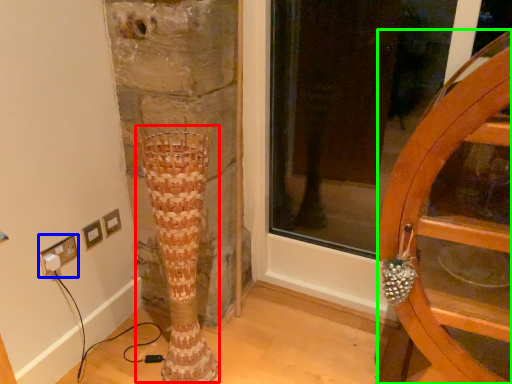
Question: Estimate the real-world distances between objects in this image. Which object is closer to tree trunk (highlighted by a red box), electric outlet (highlighted by a blue box) or furniture (highlighted by a green box)?

Choices:
 (A) electric outlet
 (B) furniture

Answer: (A)